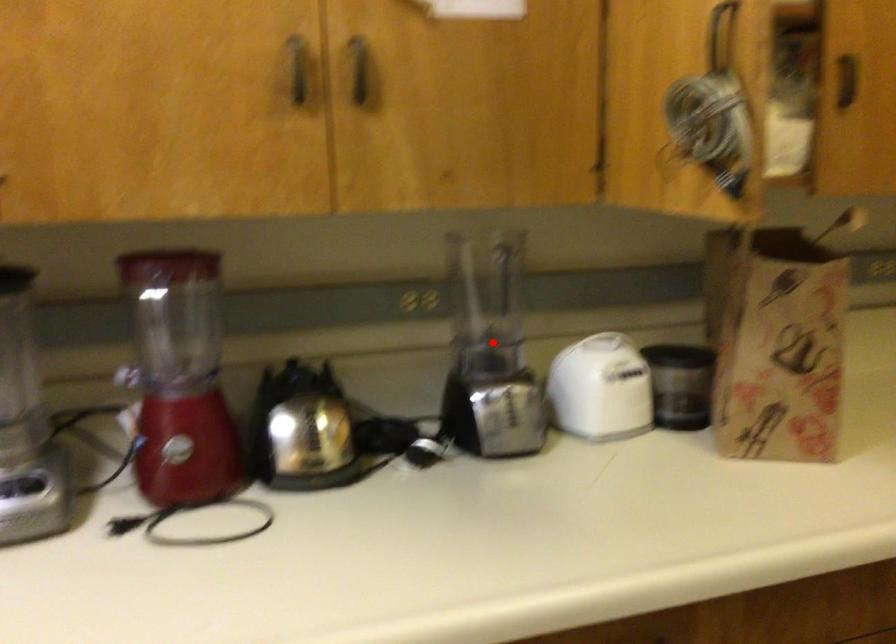
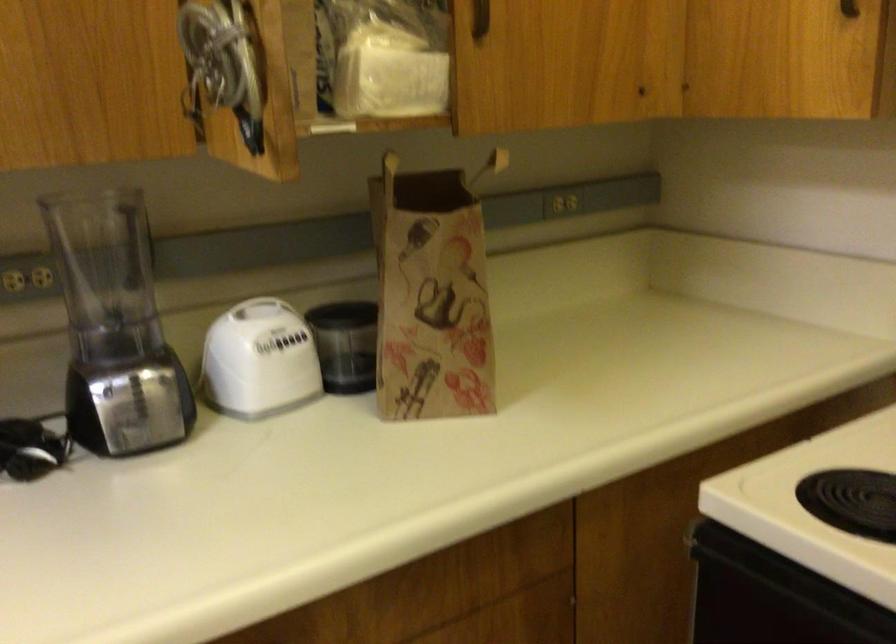
The point at the highlighted location is marked in the first image. Where is the corresponding point in the second image?

(115, 327)